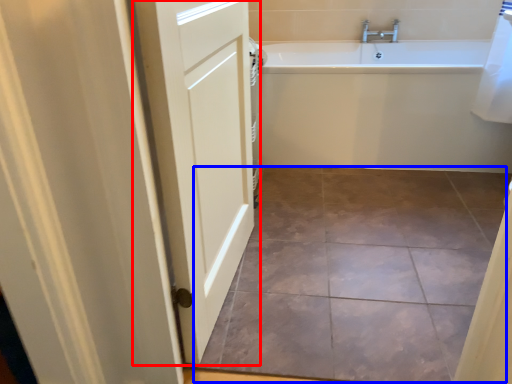
Question: Which object appears farthest to the camera in this image, door (highlighted by a red box) or ceramic tile (highlighted by a blue box)?

Choices:
 (A) door
 (B) ceramic tile

Answer: (B)